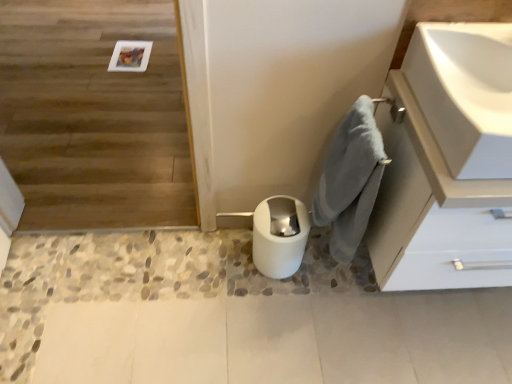
Identify the location of free space above white glossy toilet bowl at lower center (from a real-world perspective). (279, 211).